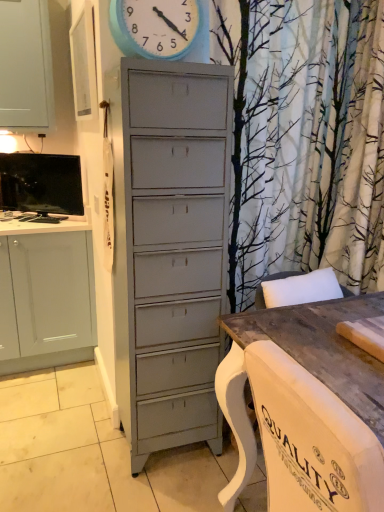
This screenshot has width=384, height=512. What do you see at coordinates (154, 27) in the screenshot? I see `blue painted wood clock at upper center` at bounding box center [154, 27].

What do you see at coordinates (316, 348) in the screenshot?
I see `wooden table at lower right` at bounding box center [316, 348].

I want to click on matte black tv at upper left, so click(41, 183).

How many degrees apart are the facing directions of wooden table at lower right and blue painted wood clock at upper center?

There is a 90-degree angle between the facing directions of wooden table at lower right and blue painted wood clock at upper center.

Measure the distance between wooden table at lower right and blue painted wood clock at upper center.

wooden table at lower right is 1.13 meters away from blue painted wood clock at upper center.

Is point (323, 336) closer to viewer compared to point (123, 27)?

That is True.

Which is behind, wooden table at lower right or blue painted wood clock at upper center?

blue painted wood clock at upper center.

Is blue painted wood clock at upper center shorter than wooden table at lower right?

Yes.

Would you say wooden table at lower right is part of blue painted wood clock at upper center's contents?

No, wooden table at lower right is not a part of blue painted wood clock at upper center.

Which of these two, blue painted wood clock at upper center or wooden table at lower right, is bigger?

wooden table at lower right is bigger.

Locate an element on the screen. The image size is (384, 512). clock behind the wooden table at lower right is located at coordinates (154, 27).

Looking at this image, from a real-world perspective, which object stands above the other?

In real-world perspective, matte black tv at upper left is above.

Looking at this image, is wooden table at lower right thinner than matte black tv at upper left?

Incorrect, the width of wooden table at lower right is not less than that of matte black tv at upper left.

Considering the points (332, 376) and (48, 189), which point is behind, point (332, 376) or point (48, 189)?

Positioned behind is point (48, 189).

Does matte black tv at upper left have a lesser height compared to blue painted wood clock at upper center?

Incorrect, the height of matte black tv at upper left does not fall short of that of blue painted wood clock at upper center.

Are matte black tv at upper left and blue painted wood clock at upper center far apart?

Yes, matte black tv at upper left is far from blue painted wood clock at upper center.

Does matte black tv at upper left have a lesser width compared to blue painted wood clock at upper center?

Yes.

Does point (44, 176) come behind point (137, 49)?

That is True.

Which is more to the right, blue painted wood clock at upper center or matte black tv at upper left?

blue painted wood clock at upper center is more to the right.

In the scene shown: Is blue painted wood clock at upper center taller than matte black tv at upper left?

In fact, blue painted wood clock at upper center may be shorter than matte black tv at upper left.

Locate an element on the screen. This screenshot has height=512, width=384. clock lying in front of the matte black tv at upper left is located at coordinates (154, 27).

Is blue painted wood clock at upper center located outside matte black tv at upper left?

blue painted wood clock at upper center is positioned outside matte black tv at upper left.

From a real-world perspective, which is physically above, matte black tv at upper left or wooden table at lower right?

matte black tv at upper left, from a real-world perspective.

Who is more distant, matte black tv at upper left or wooden table at lower right?

matte black tv at upper left is further away from the camera.

Is matte black tv at upper left taller or shorter than wooden table at lower right?

Considering their sizes, matte black tv at upper left has less height than wooden table at lower right.

Is matte black tv at upper left touching wooden table at lower right?

No.

The width and height of the screenshot is (384, 512). I want to click on table that is below the blue painted wood clock at upper center (from the image's perspective), so click(316, 348).

I want to click on clock above the wooden table at lower right (from the image's perspective), so click(154, 27).

Looking at the image, which one is located further to wooden table at lower right, blue painted wood clock at upper center or matte black tv at upper left?

matte black tv at upper left.

Considering their positions, is blue painted wood clock at upper center positioned further to matte black tv at upper left than wooden table at lower right?

The object further to matte black tv at upper left is wooden table at lower right.

From the image, which object appears to be nearer to blue painted wood clock at upper center, wooden table at lower right or matte black tv at upper left?

matte black tv at upper left.

Considering their positions, is matte black tv at upper left positioned further to wooden table at lower right than blue painted wood clock at upper center?

matte black tv at upper left lies further to wooden table at lower right than the other object.

Looking at the image, which one is located closer to matte black tv at upper left, wooden table at lower right or blue painted wood clock at upper center?

Based on the image, blue painted wood clock at upper center appears to be nearer to matte black tv at upper left.

When comparing their distances from blue painted wood clock at upper center, does matte black tv at upper left or wooden table at lower right seem further?

wooden table at lower right is further to blue painted wood clock at upper center.

The width and height of the screenshot is (384, 512). I want to click on clock between wooden table at lower right and matte black tv at upper left in the front-back direction, so click(154, 27).